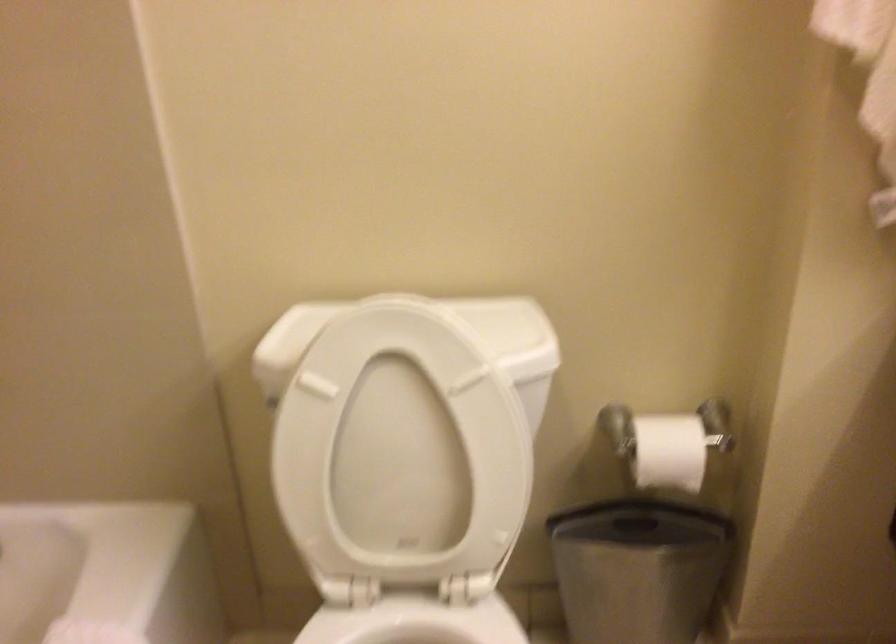
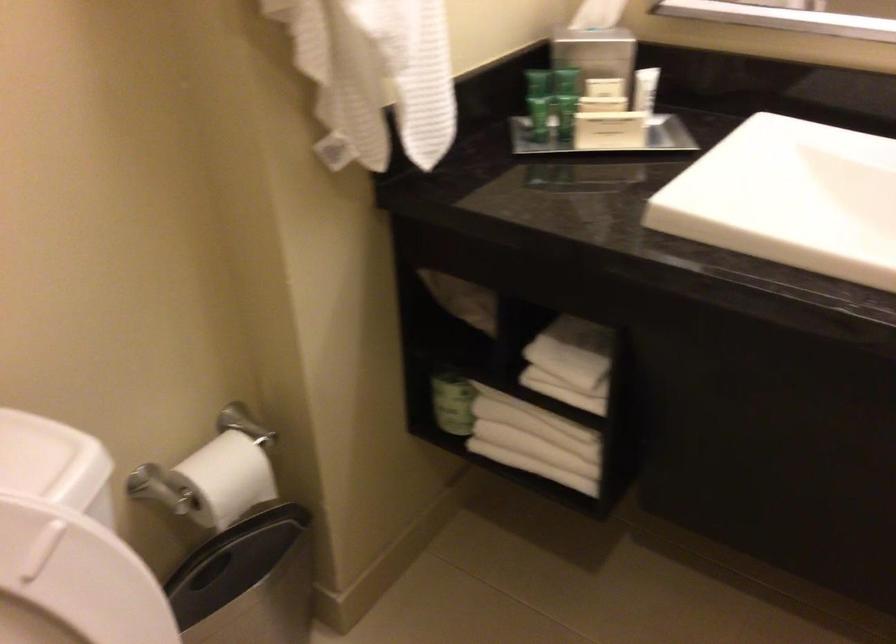
The point at (x=770, y=228) is marked in the first image. Where is the corresponding point in the second image?

(218, 210)